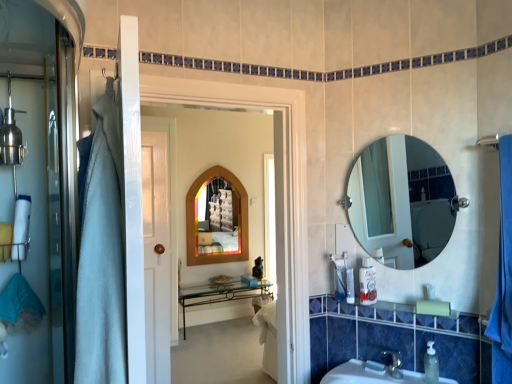
Question: Is white fabric towel at left closer to camera compared to white plastic container at right, arranged as the 1th toiletry when viewed from the top?

Choices:
 (A) no
 (B) yes

Answer: (B)

Question: From the image's perspective, does white fabric towel at left appear higher than white plastic container at right, marked as the second toiletry in a right-to-left arrangement?

Choices:
 (A) no
 (B) yes

Answer: (B)

Question: Considering the relative sizes of white fabric towel at left and white plastic container at right, the 2th toiletry when ordered from front to back, in the image provided, is white fabric towel at left wider than white plastic container at right, the 2th toiletry when ordered from front to back,?

Choices:
 (A) yes
 (B) no

Answer: (A)

Question: From the image's perspective, is white fabric towel at left beneath white plastic container at right, marked as the second toiletry in a right-to-left arrangement?

Choices:
 (A) yes
 (B) no

Answer: (B)

Question: Does white fabric towel at left have a lesser width compared to white plastic container at right, marked as the 2th toiletry in a back-to-front arrangement?

Choices:
 (A) yes
 (B) no

Answer: (B)

Question: In terms of width, does translucent plastic soap dispenser at lower right, the 1th toiletry from the back, look wider or thinner when compared to white fabric towel at left?

Choices:
 (A) wide
 (B) thin

Answer: (B)

Question: Is point (336, 297) positioned closer to the camera than point (103, 170)?

Choices:
 (A) closer
 (B) farther

Answer: (B)

Question: Considering the positions of translucent plastic soap dispenser at lower right, the 2th toiletry viewed from the top, and white fabric towel at left in the image, is translucent plastic soap dispenser at lower right, the 2th toiletry viewed from the top, taller or shorter than white fabric towel at left?

Choices:
 (A) tall
 (B) short

Answer: (B)

Question: Relative to white fabric towel at left, is translucent plastic soap dispenser at lower right, the 2th toiletry viewed from the top, in front or behind?

Choices:
 (A) behind
 (B) front

Answer: (A)

Question: Considering the positions of point (337, 279) and point (380, 367), is point (337, 279) closer or farther from the camera than point (380, 367)?

Choices:
 (A) farther
 (B) closer

Answer: (A)

Question: Considering the positions of translucent plastic soap dispenser at lower right, the 1th toiletry from the back, and translucent plastic soap at lower right in the image, is translucent plastic soap dispenser at lower right, the 1th toiletry from the back, wider or thinner than translucent plastic soap at lower right?

Choices:
 (A) thin
 (B) wide

Answer: (B)

Question: In the image, is translucent plastic soap dispenser at lower right, placed as the second toiletry when sorted from bottom to top, on the left side or the right side of translucent plastic soap at lower right?

Choices:
 (A) left
 (B) right

Answer: (A)

Question: Is translucent plastic soap dispenser at lower right, placed as the second toiletry when sorted from bottom to top, situated inside translucent plastic soap at lower right or outside?

Choices:
 (A) outside
 (B) inside

Answer: (A)

Question: Would you say wooden mirror at center is inside or outside clear glass mirror at upper right, the 2th mirror viewed from the left?

Choices:
 (A) inside
 (B) outside

Answer: (B)

Question: In terms of height, does wooden mirror at center look taller or shorter compared to clear glass mirror at upper right, the 2th mirror viewed from the left?

Choices:
 (A) short
 (B) tall

Answer: (B)